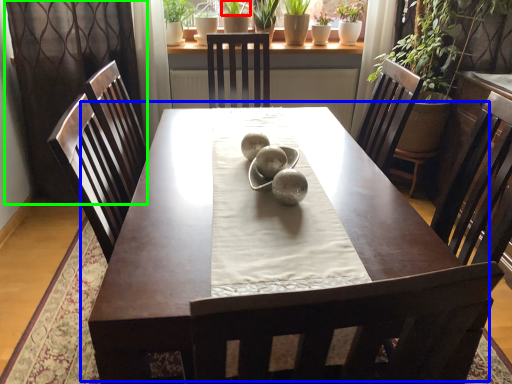
Question: Which object is positioned closest to plant (highlighted by a red box)? Select from table (highlighted by a blue box) and curtain (highlighted by a green box).

Choices:
 (A) table
 (B) curtain

Answer: (B)